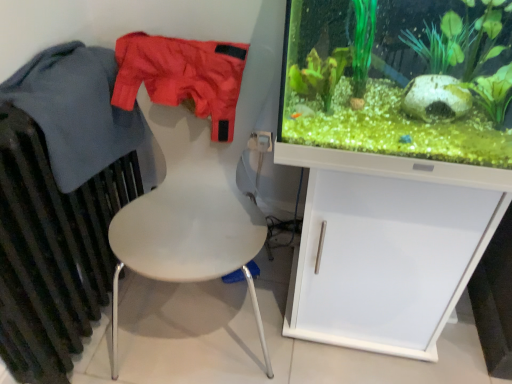
Question: Can you confirm if green matte plant at right is thinner than matte nylon shorts at upper left, which is the first clothing in right-to-left order?

Choices:
 (A) no
 (B) yes

Answer: (A)

Question: Is the depth of green matte plant at right greater than that of matte nylon shorts at upper left, the second clothing in the left-to-right sequence?

Choices:
 (A) no
 (B) yes

Answer: (A)

Question: Is green matte plant at right smaller than matte nylon shorts at upper left, the second clothing in the left-to-right sequence?

Choices:
 (A) yes
 (B) no

Answer: (B)

Question: From the image's perspective, is green matte plant at right on top of matte nylon shorts at upper left, which is the first clothing in right-to-left order?

Choices:
 (A) no
 (B) yes

Answer: (A)

Question: Is green matte plant at right next to matte nylon shorts at upper left, which is the first clothing in right-to-left order?

Choices:
 (A) yes
 (B) no

Answer: (B)

Question: From the image's perspective, is matte nylon shorts at upper left, the second clothing in the left-to-right sequence, positioned above or below white plastic chair at center?

Choices:
 (A) below
 (B) above

Answer: (B)

Question: Visually, is matte nylon shorts at upper left, which is the first clothing in right-to-left order, positioned to the left or to the right of white plastic chair at center?

Choices:
 (A) left
 (B) right

Answer: (A)

Question: From a real-world perspective, is matte nylon shorts at upper left, which is the first clothing in right-to-left order, positioned above or below white plastic chair at center?

Choices:
 (A) above
 (B) below

Answer: (A)

Question: In the image, is matte nylon shorts at upper left, which is the first clothing in right-to-left order, positioned in front of or behind white plastic chair at center?

Choices:
 (A) front
 (B) behind

Answer: (B)

Question: Is blue cotton jacket at left, the second clothing positioned from the right, taller or shorter than dark gray metallic radiator at left?

Choices:
 (A) short
 (B) tall

Answer: (A)

Question: Is blue cotton jacket at left, which is counted as the first clothing, starting from the left, to the left or to the right of dark gray metallic radiator at left in the image?

Choices:
 (A) right
 (B) left

Answer: (A)

Question: From the image's perspective, is blue cotton jacket at left, which is counted as the first clothing, starting from the left, positioned above or below dark gray metallic radiator at left?

Choices:
 (A) above
 (B) below

Answer: (A)

Question: Based on their sizes in the image, would you say blue cotton jacket at left, the second clothing positioned from the right, is bigger or smaller than dark gray metallic radiator at left?

Choices:
 (A) small
 (B) big

Answer: (A)

Question: Is matte nylon shorts at upper left, which is the first clothing in right-to-left order, bigger or smaller than blue cotton jacket at left, which is counted as the first clothing, starting from the left?

Choices:
 (A) small
 (B) big

Answer: (A)

Question: Relative to blue cotton jacket at left, which is counted as the first clothing, starting from the left, is matte nylon shorts at upper left, which is the first clothing in right-to-left order, in front or behind?

Choices:
 (A) front
 (B) behind

Answer: (B)